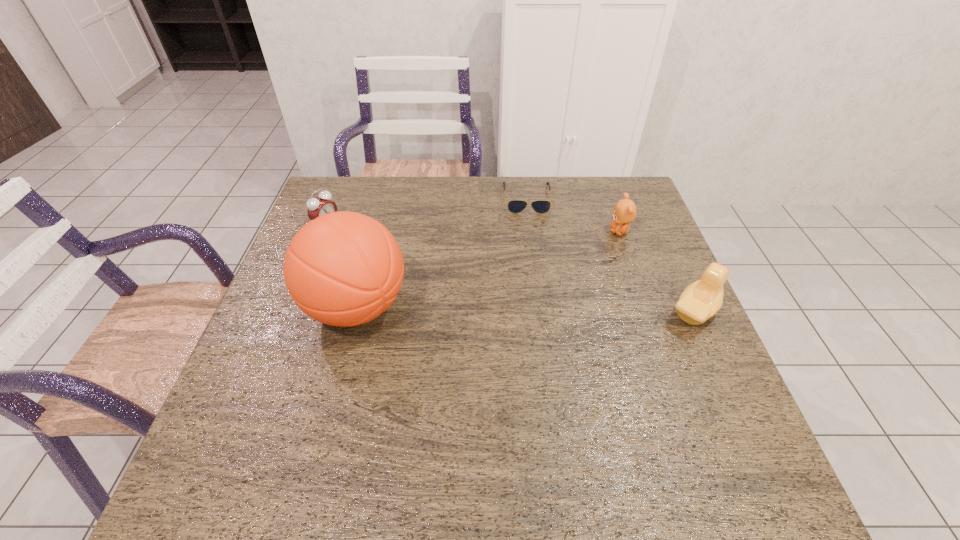
The width and height of the screenshot is (960, 540). I want to click on the tallest object, so click(x=343, y=268).

Where is `the rightmost object`? Image resolution: width=960 pixels, height=540 pixels. the rightmost object is located at coordinates (702, 299).

I want to click on the fourth object from left to right, so click(624, 212).

The height and width of the screenshot is (540, 960). Find the location of `the shortest object`. the shortest object is located at coordinates (514, 206).

Find the location of a particular element. sunglasses is located at coordinates (514, 206).

You are a GUI agent. You are given a task and a screenshot of the screen. Output one action in this format:
    pyautogui.click(x=<x>, y=<y>)
    Task: Click on the alarm clock
    
    Given the screenshot: What is the action you would take?
    pyautogui.click(x=320, y=205)

What are the coordinates of `free space located on the right of the basketball` in the screenshot? It's located at (466, 307).

This screenshot has width=960, height=540. Find the location of `vacant space located 0.060m on the face of the teddy bear`. vacant space located 0.060m on the face of the teddy bear is located at coordinates 603,248.

Image resolution: width=960 pixels, height=540 pixels. I want to click on vacant space located on the face of the teddy bear, so click(535, 308).

Find the location of a particular element. The height and width of the screenshot is (540, 960). vacant area located 0.080m on the face of the teddy bear is located at coordinates (599, 252).